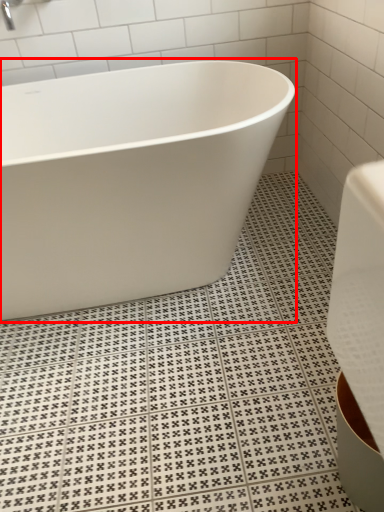
Question: From the image's perspective, what is the correct spatial positioning of bathtub (annotated by the red box) in reference to faucet?

Choices:
 (A) above
 (B) below

Answer: (B)